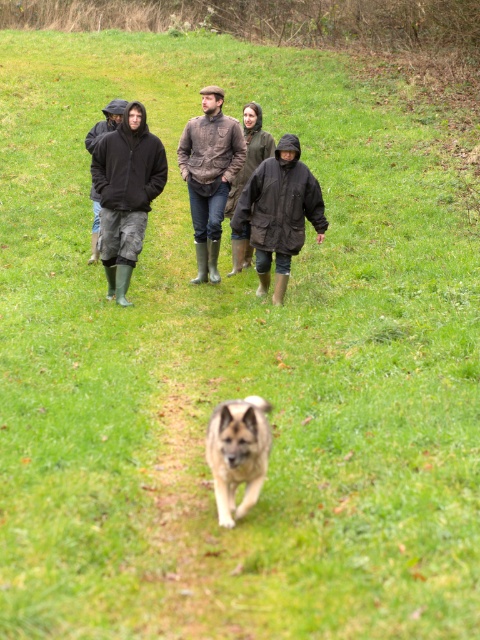
Question: Can you confirm if matte black jacket at left is bigger than matte black jacket at center?

Choices:
 (A) yes
 (B) no

Answer: (B)

Question: Which object appears closest to the camera in this image?

Choices:
 (A) light brown fur at center
 (B) brown leather jacket at center

Answer: (A)

Question: Which object is positioned farthest from the light brown fur at center?

Choices:
 (A) brown leather jacket at center
 (B) matte black jacket at center

Answer: (A)

Question: Can you confirm if matte black jacket at left is positioned to the right of light brown fur at center?

Choices:
 (A) yes
 (B) no

Answer: (B)

Question: Which point appears farthest from the camera in this image?

Choices:
 (A) [268, 433]
 (B) [137, 220]
 (C) [312, 208]
 (D) [219, 221]

Answer: (D)

Question: Is matte black jacket at left positioned at the back of brown leather jacket at center?

Choices:
 (A) yes
 (B) no

Answer: (B)